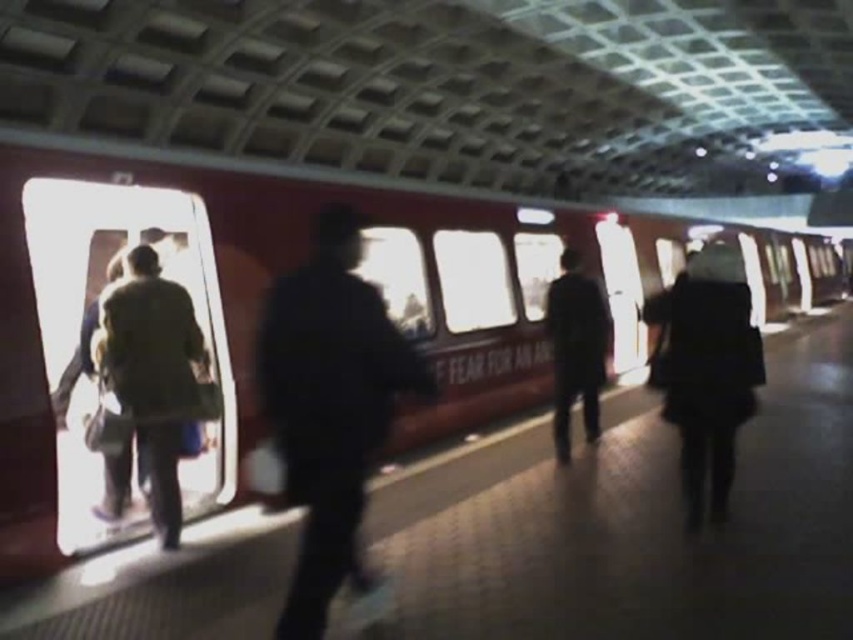
You are standing on a subway platform and see two people wearing coats. One is wearing a dark green fabric jacket at right and the other a green fabric coat at left. Which person is standing closer to the train that is partially visible on the left side of the frame?

The green fabric coat at left is closer to the train because it is positioned to the left side of the frame where the train is visible, while the dark green fabric jacket at right is further away on the right side.

Based on the photo, you are standing on the subway platform and want to board the red glossy train at center before it departs. The train doors will close in 10 seconds. You are currently at the dark blue jacket at center. Can you reach the train before the doors close if you walk at a speed of 1.5 meters per second?

The distance between the red glossy train at center and dark blue jacket at center is 6.99 meters. At a walking speed of 1.5 meters per second, it would take approximately 4.66 seconds to cover the distance. Since the doors will close in 10 seconds, you can reach the train in time.

You are a photographer trying to capture both the dark blue uniform at center and the green fabric coat at left in the same frame. Based on their positions and sizes, do you think you can fit both into your camera viewfinder without moving the camera?

The dark blue uniform at center might be wider than green fabric coat at left, so there is a possibility that both can be captured in the same frame if the camera viewfinder is wide enough to accommodate the combined width of both objects.